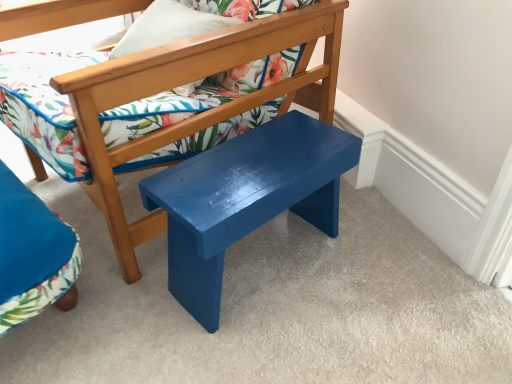
Where is `glossy wood stool at center`? This screenshot has width=512, height=384. glossy wood stool at center is located at coordinates (245, 198).

This screenshot has width=512, height=384. Describe the element at coordinates (168, 26) in the screenshot. I see `matte floral pillow at upper center` at that location.

At what (x,y) coordinates should I click in order to perform the action: click on glossy wood stool at center. Please return your answer as a coordinate pair (x, y). This screenshot has height=384, width=512. Looking at the image, I should click on (245, 198).

Which of these two, glossy wood stool at center or matte blue bench at center, arranged as the 2th chair when ordered from the bottom, is thinner?

glossy wood stool at center is thinner.

From the image's perspective, which is above, glossy wood stool at center or matte blue bench at center, arranged as the 2th chair when ordered from the bottom?

matte blue bench at center, arranged as the 2th chair when ordered from the bottom.

Is matte blue bench at center, arranged as the 2th chair when ordered from the bottom, located within glossy wood stool at center?

Definitely not — matte blue bench at center, arranged as the 2th chair when ordered from the bottom, is not inside glossy wood stool at center.

Does point (197, 245) appear closer or farther from the camera than point (58, 79)?

Point (197, 245) is farther from the camera than point (58, 79).

Consider the image. Which point is more forward, (205,25) or (26,151)?

Positioned in front is point (205,25).

Considering the sizes of objects matte floral pillow at upper center and matte blue bench at center, arranged as the 2th chair when ordered from the bottom, in the image provided, who is taller, matte floral pillow at upper center or matte blue bench at center, arranged as the 2th chair when ordered from the bottom,?

matte blue bench at center, arranged as the 2th chair when ordered from the bottom.

What's the angular difference between matte floral pillow at upper center and matte blue bench at center, arranged as the 2th chair when ordered from the bottom,'s facing directions?

4 degrees separate the facing orientations of matte floral pillow at upper center and matte blue bench at center, arranged as the 2th chair when ordered from the bottom.

Would you say matte floral pillow at upper center is a long distance from matte blue bench at center, arranged as the 2th chair when ordered from the bottom?

matte floral pillow at upper center is actually quite close to matte blue bench at center, arranged as the 2th chair when ordered from the bottom.

Is matte floral pillow at upper center oriented towards glossy wood stool at center?

No, matte floral pillow at upper center is not oriented towards glossy wood stool at center.

Is matte floral pillow at upper center at the left side of glossy wood stool at center?

Indeed, matte floral pillow at upper center is positioned on the left side of glossy wood stool at center.

Locate an element on the screen. The width and height of the screenshot is (512, 384). pillow behind the glossy wood stool at center is located at coordinates (168, 26).

Is matte floral pillow at upper center taller or shorter than glossy wood stool at center?

matte floral pillow at upper center is shorter than glossy wood stool at center.

Is velvet blue chair at lower left, which appears as the 1th chair when ordered from the bottom, situated inside matte blue bench at center, which is counted as the 1th chair, starting from the top, or outside?

velvet blue chair at lower left, which appears as the 1th chair when ordered from the bottom, lies outside matte blue bench at center, which is counted as the 1th chair, starting from the top.

Which is more to the left, velvet blue chair at lower left, placed as the 2th chair when sorted from top to bottom, or matte blue bench at center, which is counted as the 1th chair, starting from the top?

From the viewer's perspective, velvet blue chair at lower left, placed as the 2th chair when sorted from top to bottom, appears more on the left side.

Is velvet blue chair at lower left, placed as the 2th chair when sorted from top to bottom, taller or shorter than matte blue bench at center, arranged as the 2th chair when ordered from the bottom?

In the image, velvet blue chair at lower left, placed as the 2th chair when sorted from top to bottom, appears to be shorter than matte blue bench at center, arranged as the 2th chair when ordered from the bottom.

Can you confirm if matte blue bench at center, arranged as the 2th chair when ordered from the bottom, is positioned to the right of glossy wood stool at center?

No, matte blue bench at center, arranged as the 2th chair when ordered from the bottom, is not to the right of glossy wood stool at center.

Is the surface of matte blue bench at center, arranged as the 2th chair when ordered from the bottom, in direct contact with glossy wood stool at center?

No, matte blue bench at center, arranged as the 2th chair when ordered from the bottom, is not touching glossy wood stool at center.

From a real-world perspective, which is physically above, matte blue bench at center, arranged as the 2th chair when ordered from the bottom, or glossy wood stool at center?

From a 3D spatial view, matte blue bench at center, arranged as the 2th chair when ordered from the bottom, is above.

From a real-world perspective, relative to matte floral pillow at upper center, is velvet blue chair at lower left, which appears as the 1th chair when ordered from the bottom, vertically above or below?

velvet blue chair at lower left, which appears as the 1th chair when ordered from the bottom, is below matte floral pillow at upper center.

Between point (15, 208) and point (233, 17), which one is positioned in front?

The point (15, 208) is closer.

Does velvet blue chair at lower left, which appears as the 1th chair when ordered from the bottom, appear on the right side of matte floral pillow at upper center?

No, velvet blue chair at lower left, which appears as the 1th chair when ordered from the bottom, is not to the right of matte floral pillow at upper center.

Would you say matte floral pillow at upper center is part of velvet blue chair at lower left, which appears as the 1th chair when ordered from the bottom,'s contents?

No, matte floral pillow at upper center is not a part of velvet blue chair at lower left, which appears as the 1th chair when ordered from the bottom.

From a real-world perspective, is matte blue bench at center, arranged as the 2th chair when ordered from the bottom, located higher than matte floral pillow at upper center?

Actually, matte blue bench at center, arranged as the 2th chair when ordered from the bottom, is physically below matte floral pillow at upper center in the real world.

Which object is closer to the camera taking this photo, matte blue bench at center, which is counted as the 1th chair, starting from the top, or matte floral pillow at upper center?

Positioned in front is matte blue bench at center, which is counted as the 1th chair, starting from the top.

In the scene shown: Which object is wider, matte blue bench at center, which is counted as the 1th chair, starting from the top, or matte floral pillow at upper center?

With larger width is matte blue bench at center, which is counted as the 1th chair, starting from the top.

Find the location of a particular element. The width and height of the screenshot is (512, 384). chair that is the 1st one when counting leftward from the glossy wood stool at center is located at coordinates (196, 115).

Identify the location of pillow above the matte blue bench at center, arranged as the 2th chair when ordered from the bottom (from the image's perspective). (168, 26).

Based on their spatial positions, is velvet blue chair at lower left, which appears as the 1th chair when ordered from the bottom, or matte floral pillow at upper center closer to glossy wood stool at center?

The object closer to glossy wood stool at center is velvet blue chair at lower left, which appears as the 1th chair when ordered from the bottom.

When comparing their distances from matte blue bench at center, which is counted as the 1th chair, starting from the top, does glossy wood stool at center or velvet blue chair at lower left, which appears as the 1th chair when ordered from the bottom, seem further?

velvet blue chair at lower left, which appears as the 1th chair when ordered from the bottom, lies further to matte blue bench at center, which is counted as the 1th chair, starting from the top, than the other object.

Based on their spatial positions, is velvet blue chair at lower left, placed as the 2th chair when sorted from top to bottom, or matte floral pillow at upper center closer to matte blue bench at center, arranged as the 2th chair when ordered from the bottom?

The object closer to matte blue bench at center, arranged as the 2th chair when ordered from the bottom, is matte floral pillow at upper center.

Estimate the real-world distances between objects in this image. Which object is closer to velvet blue chair at lower left, placed as the 2th chair when sorted from top to bottom, matte blue bench at center, arranged as the 2th chair when ordered from the bottom, or matte floral pillow at upper center?

Based on the image, matte blue bench at center, arranged as the 2th chair when ordered from the bottom, appears to be nearer to velvet blue chair at lower left, placed as the 2th chair when sorted from top to bottom.

Based on their spatial positions, is matte blue bench at center, arranged as the 2th chair when ordered from the bottom, or matte floral pillow at upper center further from glossy wood stool at center?

Among the two, matte floral pillow at upper center is located further to glossy wood stool at center.

Considering their positions, is matte blue bench at center, arranged as the 2th chair when ordered from the bottom, positioned further to matte floral pillow at upper center than glossy wood stool at center?

glossy wood stool at center.

Based on their spatial positions, is glossy wood stool at center or matte floral pillow at upper center closer to matte blue bench at center, arranged as the 2th chair when ordered from the bottom?

Among the two, glossy wood stool at center is located nearer to matte blue bench at center, arranged as the 2th chair when ordered from the bottom.

From the image, which object appears to be farther from velvet blue chair at lower left, placed as the 2th chair when sorted from top to bottom, glossy wood stool at center or matte blue bench at center, which is counted as the 1th chair, starting from the top?

Based on the image, glossy wood stool at center appears to be further to velvet blue chair at lower left, placed as the 2th chair when sorted from top to bottom.

The image size is (512, 384). Find the location of `chair between velvet blue chair at lower left, placed as the 2th chair when sorted from top to bottom, and glossy wood stool at center, in the horizontal direction`. chair between velvet blue chair at lower left, placed as the 2th chair when sorted from top to bottom, and glossy wood stool at center, in the horizontal direction is located at coordinates [196, 115].

The width and height of the screenshot is (512, 384). Find the location of `chair between matte floral pillow at upper center and glossy wood stool at center vertically`. chair between matte floral pillow at upper center and glossy wood stool at center vertically is located at coordinates (196, 115).

Find the location of a particular element. chair between matte floral pillow at upper center and velvet blue chair at lower left, placed as the 2th chair when sorted from top to bottom, in the up-down direction is located at coordinates (196, 115).

I want to click on pillow situated between velvet blue chair at lower left, which appears as the 1th chair when ordered from the bottom, and glossy wood stool at center from left to right, so click(168, 26).